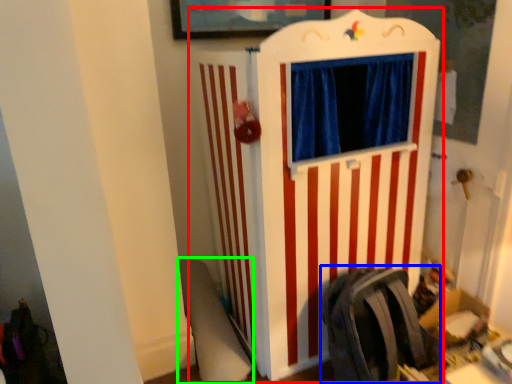
Question: Based on their relative distances, which object is farther from furniture (highlighted by a red box)? Choose from folding chair (highlighted by a blue box) and swivel chair (highlighted by a green box).

Choices:
 (A) folding chair
 (B) swivel chair

Answer: (B)